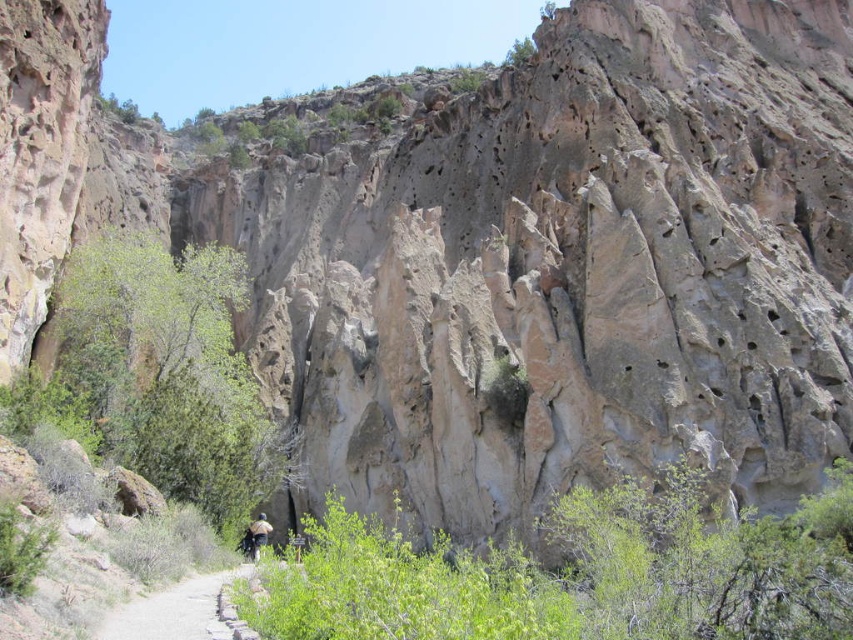
Question: Is gravel path at center bigger than brown fabric backpack at center?

Choices:
 (A) no
 (B) yes

Answer: (B)

Question: Which of the following is the closest to the observer?

Choices:
 (A) (128, 618)
 (B) (251, 556)

Answer: (A)

Question: Does gravel path at center have a lesser width compared to brown fabric backpack at center?

Choices:
 (A) no
 (B) yes

Answer: (A)

Question: Is gravel path at center positioned behind brown fabric backpack at center?

Choices:
 (A) yes
 (B) no

Answer: (B)